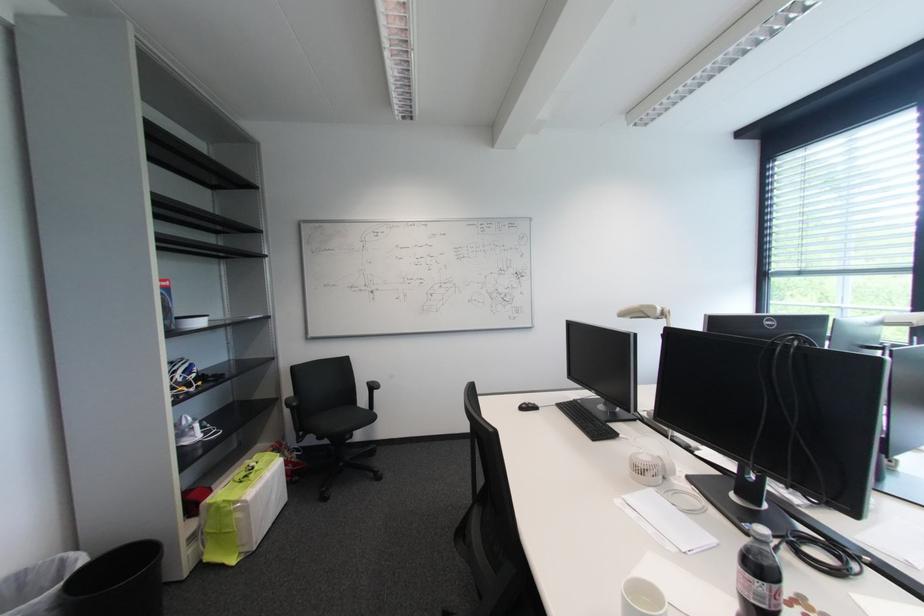
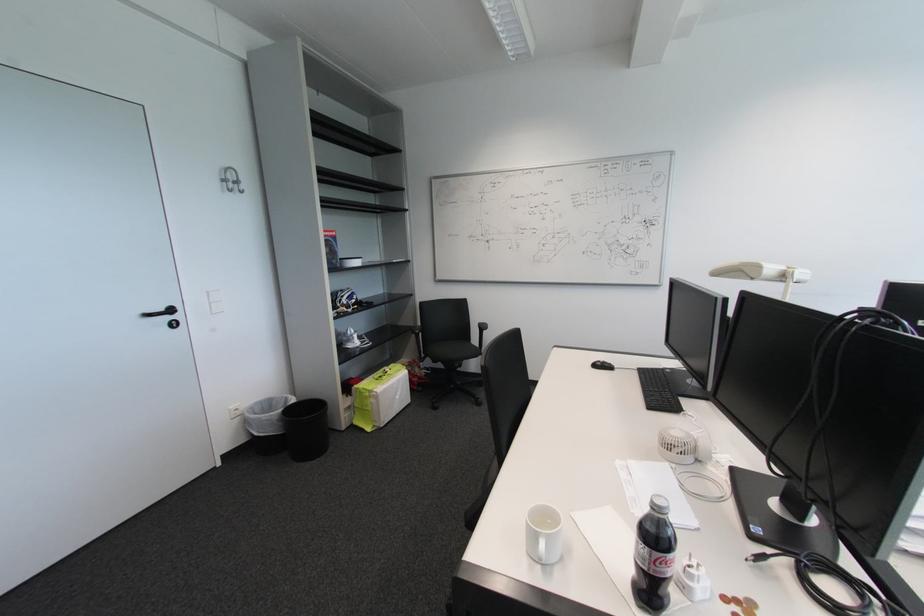
Question: What movement of the cameraman would produce the second image?

Choices:
 (A) Left
 (B) Right
 (C) Forward
 (D) Backward

Answer: (B)